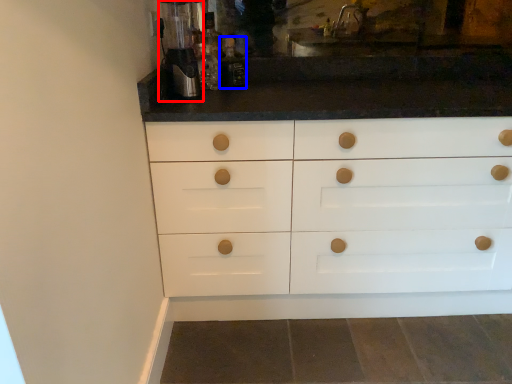
Question: Which of the following is the farthest to the observer, coffee machine (highlighted by a red box) or bottle (highlighted by a blue box)?

Choices:
 (A) coffee machine
 (B) bottle

Answer: (B)